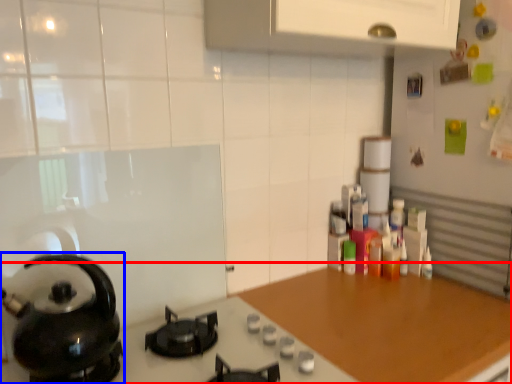
Question: Which of the following is the farthest to the observer, countertop (highlighted by a red box) or kitchen appliance (highlighted by a blue box)?

Choices:
 (A) countertop
 (B) kitchen appliance

Answer: (A)